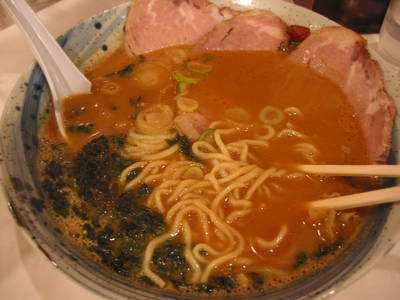
Locate an element on the screen. Image resolution: width=400 pixels, height=300 pixels. blue swirl design on bowl is located at coordinates (32, 99).